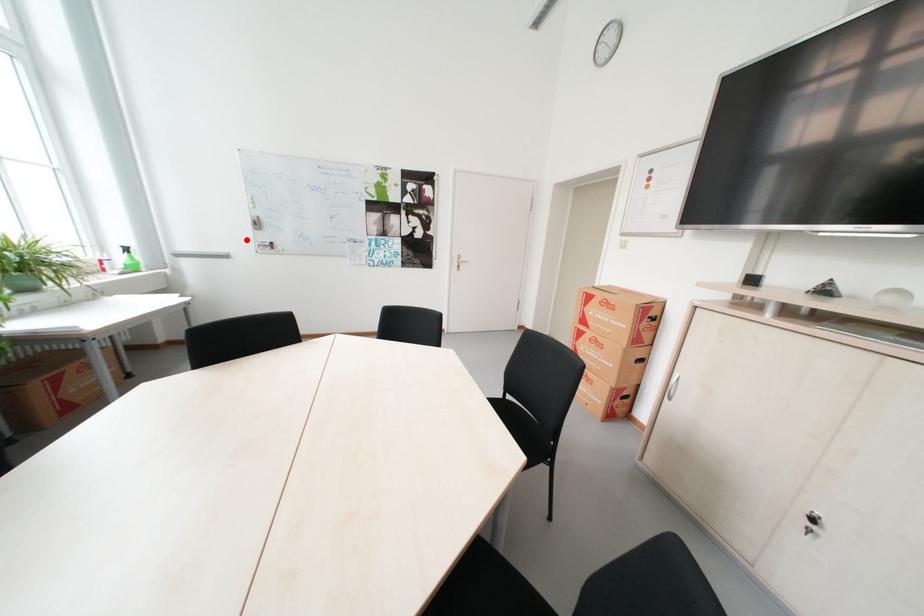
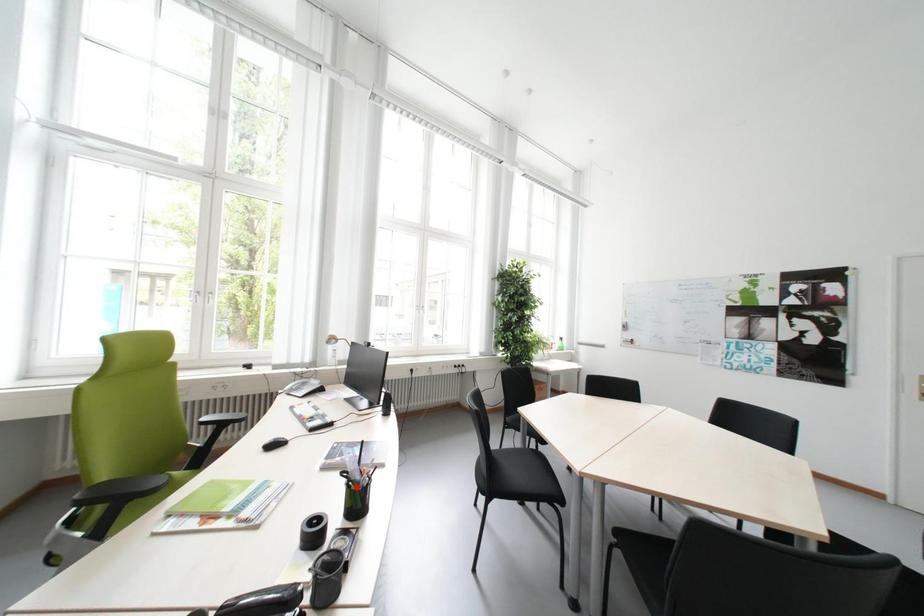
Consider the image. I am providing you with two images of the same scene from different viewpoints. A red point is marked on the first image and another point is marked on the second image. Are the points marked in image1 and image2 representing the same 3D position?

No